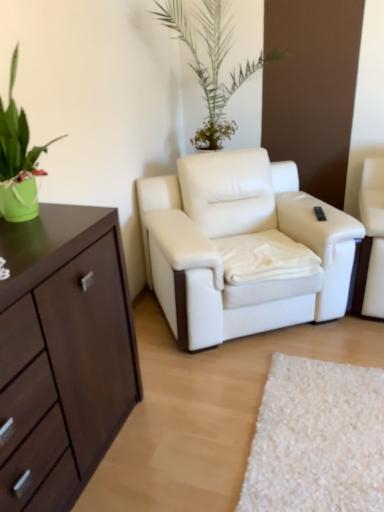
What are the coordinates of `white leather armchair at center` in the screenshot? It's located at (242, 248).

Looking at their sizes, would you say green matte pot at left is wider or thinner than white leather armchair at center?

green matte pot at left is thinner than white leather armchair at center.

Between green matte pot at left and white leather armchair at center, which one has smaller size?

Smaller between the two is green matte pot at left.

From a real-world perspective, between green matte pot at left and white leather armchair at center, who is vertically lower?

white leather armchair at center is physically lower.

From the image's perspective, is green matte pot at left beneath black plastic remote control at upper right?

No.

Is green matte pot at left closer to camera compared to black plastic remote control at upper right?

Yes, green matte pot at left is in front of black plastic remote control at upper right.

From the image's perspective, who appears lower, white leather armchair at center or green matte pot at left?

white leather armchair at center, from the image's perspective.

Is white leather armchair at center not close to green matte pot at left?

white leather armchair at center is positioned a significant distance from green matte pot at left.

Considering the positions of objects white leather armchair at center and green matte pot at left in the image provided, who is behind, white leather armchair at center or green matte pot at left?

white leather armchair at center is further from the camera.

Consider the image. Who is smaller, white leather armchair at center or green matte pot at left?

Smaller between the two is green matte pot at left.

Consider the image. Is black plastic remote control at upper right at the back of white leather armchair at center?

No, black plastic remote control at upper right is not at the back of white leather armchair at center.

Is white leather armchair at center next to black plastic remote control at upper right?

No, white leather armchair at center is not making contact with black plastic remote control at upper right.

In terms of width, does white leather armchair at center look wider or thinner when compared to black plastic remote control at upper right?

Considering their sizes, white leather armchair at center looks broader than black plastic remote control at upper right.

Is black plastic remote control at upper right situated inside white leather armchair at center or outside?

black plastic remote control at upper right is inside white leather armchair at center.

There is a white leather armchair at center. Find the location of `remote control above it (from a real-world perspective)`. remote control above it (from a real-world perspective) is located at coordinates 319,213.

From the image's perspective, which one is positioned lower, black plastic remote control at upper right or white leather armchair at center?

white leather armchair at center.

Considering the sizes of objects black plastic remote control at upper right and white leather armchair at center in the image provided, who is smaller, black plastic remote control at upper right or white leather armchair at center?

black plastic remote control at upper right.

Is black plastic remote control at upper right to the left or to the right of green matte pot at left in the image?

From the image, it's evident that black plastic remote control at upper right is to the right of green matte pot at left.

Is green matte pot at left at the back of black plastic remote control at upper right?

black plastic remote control at upper right does not have its back to green matte pot at left.

Can green matte pot at left be found inside black plastic remote control at upper right?

No, black plastic remote control at upper right does not contain green matte pot at left.

Find the location of a particular element. Image resolution: width=384 pixels, height=512 pixels. chair that is behind the green matte pot at left is located at coordinates (242, 248).

Find the location of a particular element. houseplant that appears on the left of black plastic remote control at upper right is located at coordinates (18, 160).

Considering their positions, is green matte pot at left positioned further to black plastic remote control at upper right than white leather armchair at center?

Based on the image, green matte pot at left appears to be further to black plastic remote control at upper right.

From the image, which object appears to be farther from green matte pot at left, white leather armchair at center or black plastic remote control at upper right?

black plastic remote control at upper right is positioned further to the anchor green matte pot at left.

Based on their spatial positions, is white leather armchair at center or green matte pot at left closer to black plastic remote control at upper right?

white leather armchair at center lies closer to black plastic remote control at upper right than the other object.

Considering their positions, is black plastic remote control at upper right positioned further to green matte pot at left than white leather armchair at center?

The object further to green matte pot at left is black plastic remote control at upper right.

From the image, which object appears to be nearer to white leather armchair at center, green matte pot at left or black plastic remote control at upper right?

Based on the image, black plastic remote control at upper right appears to be nearer to white leather armchair at center.

Based on their spatial positions, is black plastic remote control at upper right or green matte pot at left further from white leather armchair at center?

Among the two, green matte pot at left is located further to white leather armchair at center.

The width and height of the screenshot is (384, 512). I want to click on chair located between green matte pot at left and black plastic remote control at upper right in the left-right direction, so click(242, 248).